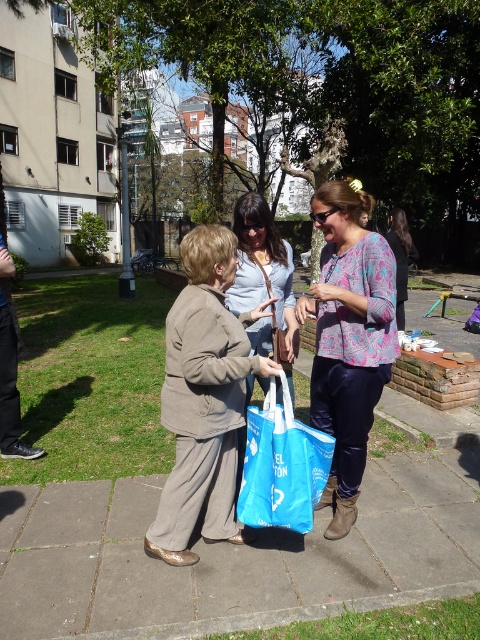
Based on the scene description, which clothing item is positioned lower between the matte brown jacket at center and the light blue cotton shirt at center?

The matte brown jacket at center is located below the light blue cotton shirt at center, so the matte brown jacket at center is positioned lower.

You are a photographer trying to capture a group photo of the light blue cotton shirt at center and the patterned fabric shirt at center. The camera you are using has a maximum focus range of 3.5 meters. Will both subjects be in focus?

The light blue cotton shirt at center and the patterned fabric shirt at center are 3.60 meters apart from each other. Since the camera can only focus up to 3.5 meters, the distance between them exceeds the focus range, so both subjects may not be in focus simultaneously.